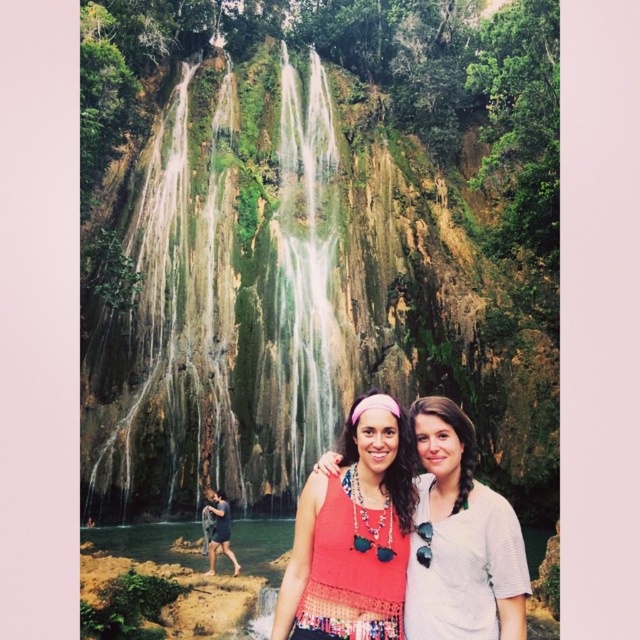
Question: In this image, where is green mossy waterfall at center located relative to crochet tank top at center?

Choices:
 (A) left
 (B) right

Answer: (A)

Question: Can you confirm if green mossy waterfall at center is positioned above dark blue shorts at lower left?

Choices:
 (A) yes
 (B) no

Answer: (A)

Question: Can you confirm if white textured shirt at center is wider than dark blue shorts at lower left?

Choices:
 (A) no
 (B) yes

Answer: (B)

Question: Which is nearer to the green mossy waterfall at center?

Choices:
 (A) crochet tank top at center
 (B) white textured shirt at center
 (C) dark blue shorts at lower left

Answer: (C)

Question: Which point is closer to the camera?

Choices:
 (A) (349, 540)
 (B) (285, 401)

Answer: (A)

Question: Which point is farther to the camera?

Choices:
 (A) green mossy waterfall at center
 (B) crochet tank top at center

Answer: (A)